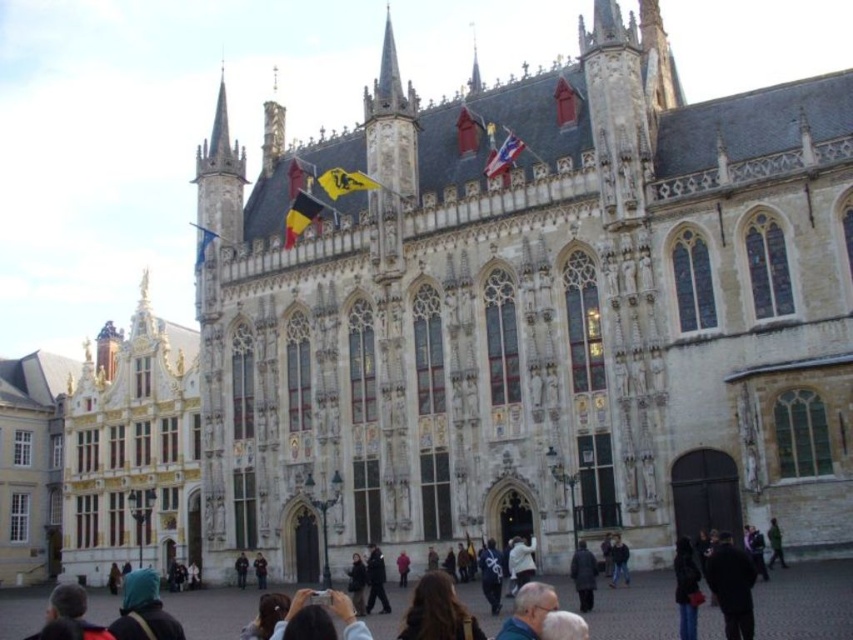
You are a tourist standing in front of the historic building and notice two features at the center of the facade. One is brown hair at center and the other is black fabric flag at center. Which one is positioned lower on the building?

The brown hair at center is located below the black fabric flag at center, so the brown hair at center is positioned lower on the building.

You are standing in front of the historic building and see two jackets. The black leather jacket at lower right and the dark blue jacket at center. Which jacket is positioned to the right of the other?

The black leather jacket at lower right is positioned to the right of the dark blue jacket at center.